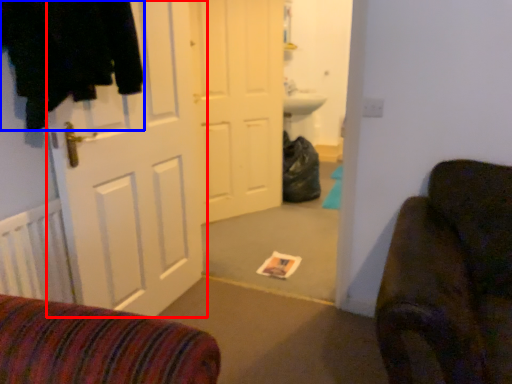
Question: Which object is closer to the camera taking this photo, door (highlighted by a red box) or clothing (highlighted by a blue box)?

Choices:
 (A) door
 (B) clothing

Answer: (B)